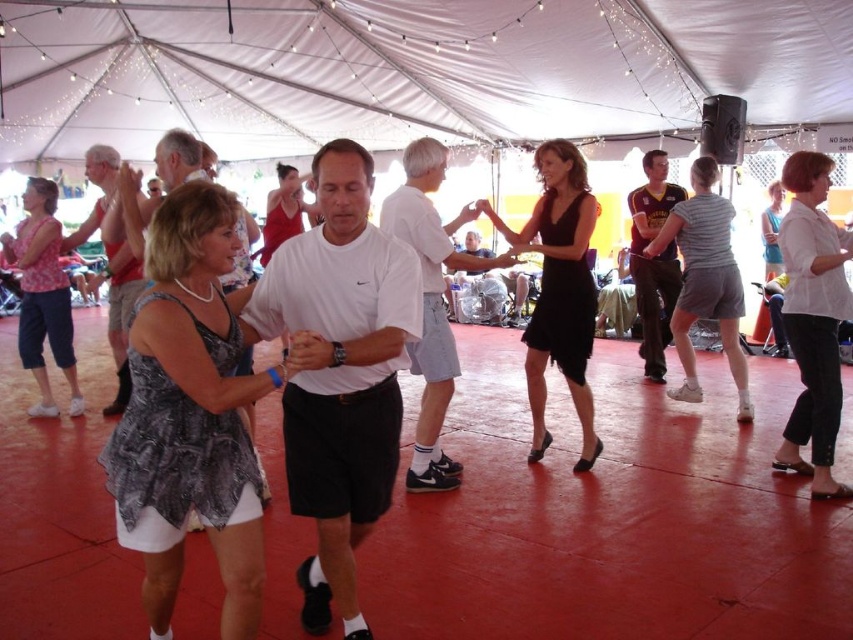
Based on the photo, is white cotton shirt at center positioned before blue denim jeans at lower right?

Yes, white cotton shirt at center is in front of blue denim jeans at lower right.

Between white cotton shirt at center and blue denim jeans at lower right, which one has less height?

Standing shorter between the two is white cotton shirt at center.

Is point (431, 172) farther from viewer compared to point (767, 349)?

No, (431, 172) is in front of (767, 349).

You are a GUI agent. You are given a task and a screenshot of the screen. Output one action in this format:
    pyautogui.click(x=<x>, y=<y>)
    Task: Click on the white cotton shirt at center
    This screenshot has height=640, width=853.
    Given the screenshot: What is the action you would take?
    (x=431, y=304)

Who is lower down, white matte t-shirt at center or matte gray dress at center?

white matte t-shirt at center

Is point (339, 477) positioned after point (125, 179)?

No, it is in front of (125, 179).

Identify the location of white matte t-shirt at center. The width and height of the screenshot is (853, 640). (339, 372).

Who is shorter, white matte t-shirt at center or white cotton shirt at center?

Standing shorter between the two is white matte t-shirt at center.

Can you confirm if white matte t-shirt at center is thinner than white cotton shirt at center?

Correct, white matte t-shirt at center's width is less than white cotton shirt at center's.

I want to click on white matte t-shirt at center, so click(339, 372).

I want to click on white matte t-shirt at center, so tap(339, 372).